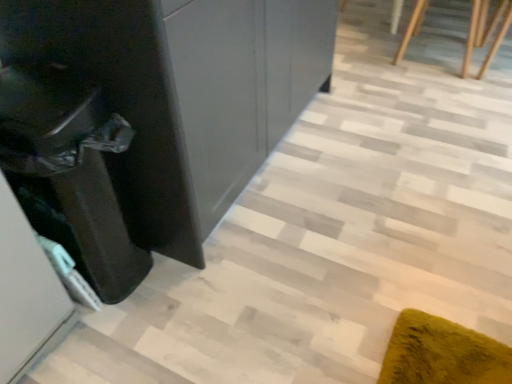
Question: Does point (200, 100) appear closer or farther from the camera than point (472, 19)?

Choices:
 (A) farther
 (B) closer

Answer: (B)

Question: Relative to wooden staircase at upper right, is glossy black dresser at left in front or behind?

Choices:
 (A) front
 (B) behind

Answer: (A)

Question: Which is farther from the wooden staircase at upper right?

Choices:
 (A) glossy black dresser at left
 (B) black glossy cabinet at left

Answer: (B)

Question: Considering the real-world distances, which object is farthest from the wooden staircase at upper right?

Choices:
 (A) black glossy cabinet at left
 (B) glossy black dresser at left

Answer: (A)